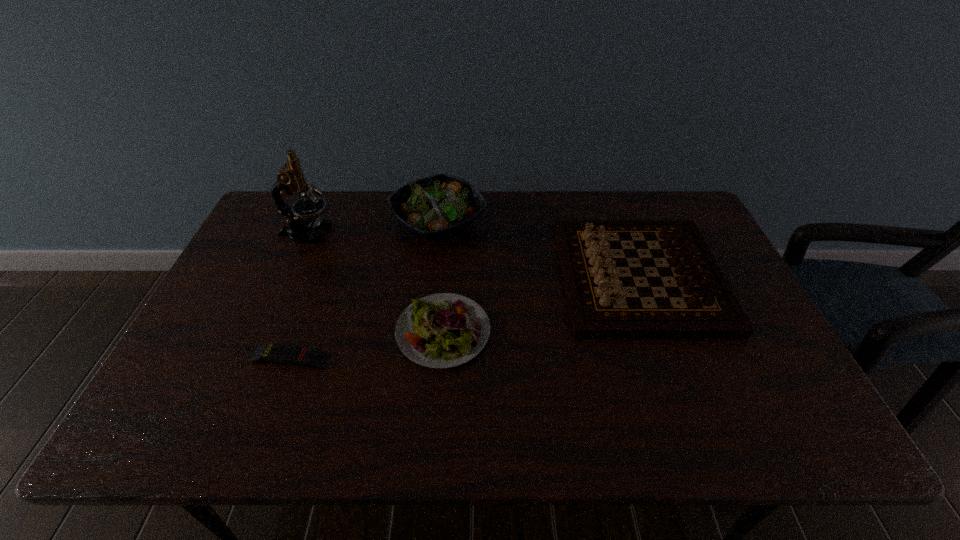
Where is `empty space that is in between the shorter salad plate and the rightmost object`? Image resolution: width=960 pixels, height=540 pixels. empty space that is in between the shorter salad plate and the rightmost object is located at coordinates (541, 304).

You are a GUI agent. You are given a task and a screenshot of the screen. Output one action in this format:
    pyautogui.click(x=<x>, y=<y>)
    Task: Click on the free space between the taller salad plate and the nearer salad plate
    The width and height of the screenshot is (960, 540).
    Given the screenshot: What is the action you would take?
    pyautogui.click(x=441, y=277)

You are a GUI agent. You are given a task and a screenshot of the screen. Output one action in this format:
    pyautogui.click(x=<x>, y=<y>)
    Task: Click on the free space that is in between the farther salad plate and the gameboard
    
    Given the screenshot: What is the action you would take?
    pyautogui.click(x=539, y=249)

Find the location of `empty location between the microscope and the farther salad plate`. empty location between the microscope and the farther salad plate is located at coordinates click(x=372, y=228).

Where is `vacant area that lies between the nearer salad plate and the tallest object`? This screenshot has width=960, height=540. vacant area that lies between the nearer salad plate and the tallest object is located at coordinates (374, 282).

The width and height of the screenshot is (960, 540). I want to click on free space between the nearer salad plate and the remote control, so click(x=367, y=345).

Identify which object is the third nearest to the remote control. Please provide its 2D coordinates. Your answer should be formatted as a tuple, i.e. [(x, y)], where the tuple contains the x and y coordinates of a point satisfying the conditions above.

[(291, 178)]

Identify which object is located as the fourth nearest to the shortest object. Please provide its 2D coordinates. Your answer should be formatted as a tuple, i.e. [(x, y)], where the tuple contains the x and y coordinates of a point satisfying the conditions above.

[(600, 305)]

Locate an element on the screen. vacant position in the image that satisfies the following two spatial constraints: 1. at the eyepiece of the remote control; 2. on the right side of the tallest object is located at coordinates (252, 358).

In order to click on vacant region that satisfies the following two spatial constraints: 1. on the front side of the shorter salad plate; 2. on the left side of the farther salad plate in this screenshot , I will do `click(426, 332)`.